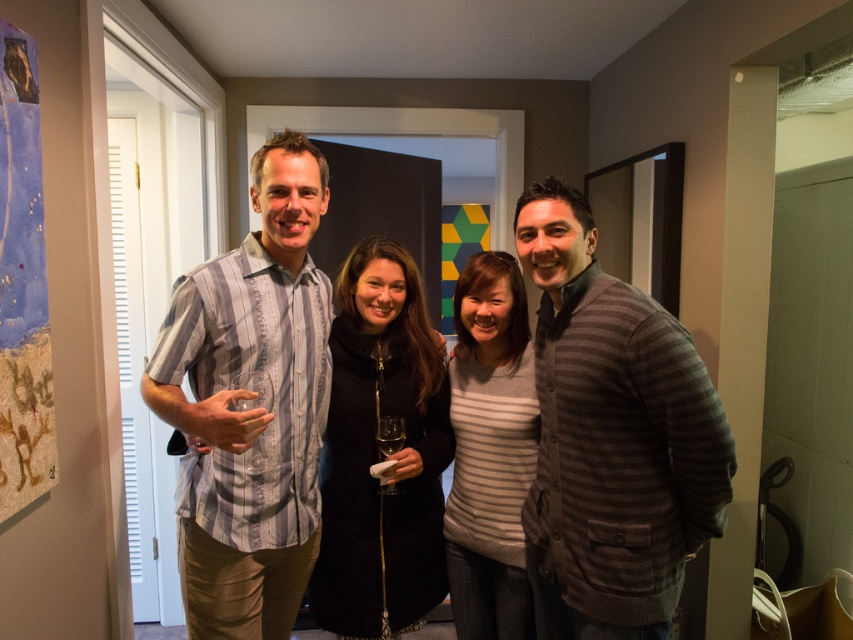
In the scene, there are two people wearing striped clothing. The first is wearing a striped cotton shirt at left, and the second is wearing a dark gray striped sweater at right. From the photographer s perspective, which of these two striped items of clothing is positioned to the right?

The dark gray striped sweater at right is positioned to the right of the striped cotton shirt at left, so the dark gray striped sweater at right is the one to the right.

You are planning to hang two items in a closet. The striped cotton shirt at left and the striped knit sweater at center. If the closet bar can only hold one item, which one should you choose to hang based on their widths?

The striped cotton shirt at left is wider than the striped knit sweater at center, so you should hang the striped cotton shirt at left to utilize the space effectively.